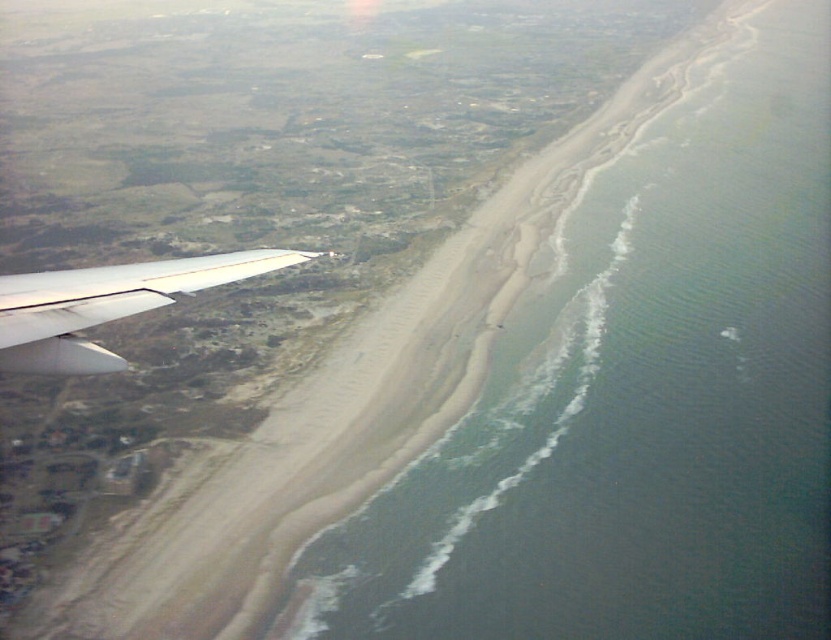
Question: Which point is closer to the camera?

Choices:
 (A) (697, 106)
 (B) (85, 284)

Answer: (B)

Question: Does green water at beach right lie behind white matte wing at lower left?

Choices:
 (A) yes
 (B) no

Answer: (A)

Question: Does green water at beach right have a greater width compared to white matte wing at lower left?

Choices:
 (A) yes
 (B) no

Answer: (A)

Question: Can you confirm if green water at beach right is smaller than white matte wing at lower left?

Choices:
 (A) no
 (B) yes

Answer: (A)